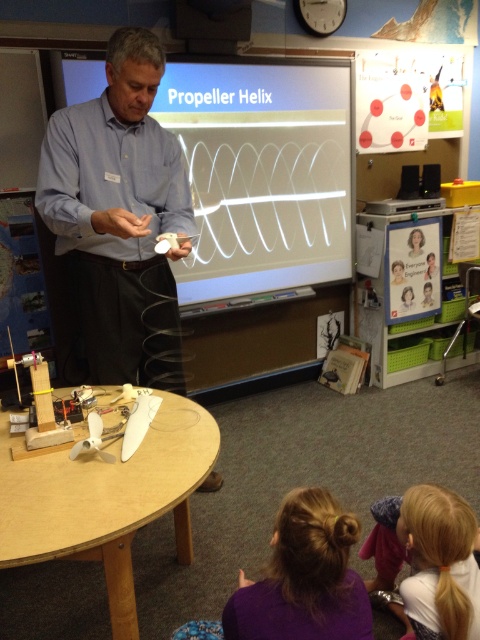
Who is positioned more to the right, blonde hair bun at lower center or blonde hair at lower right?

Positioned to the right is blonde hair at lower right.

Is blonde hair bun at lower center wider than blonde hair at lower right?

Correct, the width of blonde hair bun at lower center exceeds that of blonde hair at lower right.

Is point (312, 545) behind point (439, 541)?

No, it is not.

This screenshot has height=640, width=480. Identify the location of blonde hair bun at lower center. (303, 577).

Does matte white propeller helix at center have a larger size compared to matte blue shirt at center?

Indeed, matte white propeller helix at center has a larger size compared to matte blue shirt at center.

Between matte white propeller helix at center and matte blue shirt at center, which one has more height?

Standing taller between the two is matte white propeller helix at center.

Does point (268, 268) lie in front of point (87, 305)?

That is False.

The height and width of the screenshot is (640, 480). Identify the location of matte white propeller helix at center. (263, 172).

Does point (159, 182) come in front of point (408, 493)?

No, (159, 182) is further to viewer.

Is matte blue shirt at center thinner than blonde hair at lower right?

No.

Does point (122, 316) come in front of point (435, 497)?

No, it is behind (435, 497).

You are a GUI agent. You are given a task and a screenshot of the screen. Output one action in this format:
    pyautogui.click(x=<x>, y=<y>)
    Task: Click on the matte blue shirt at center
    The width and height of the screenshot is (480, 640).
    Given the screenshot: What is the action you would take?
    pyautogui.click(x=119, y=218)